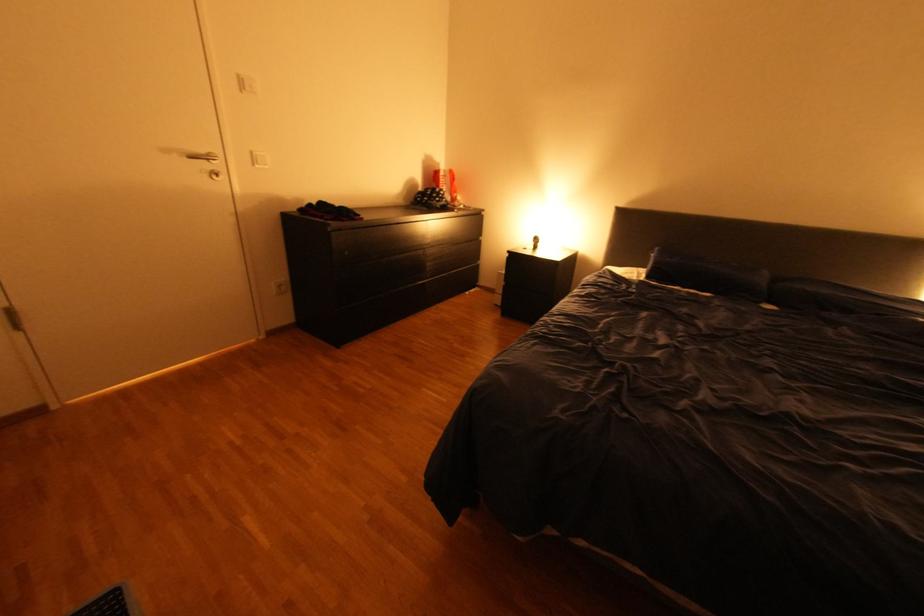
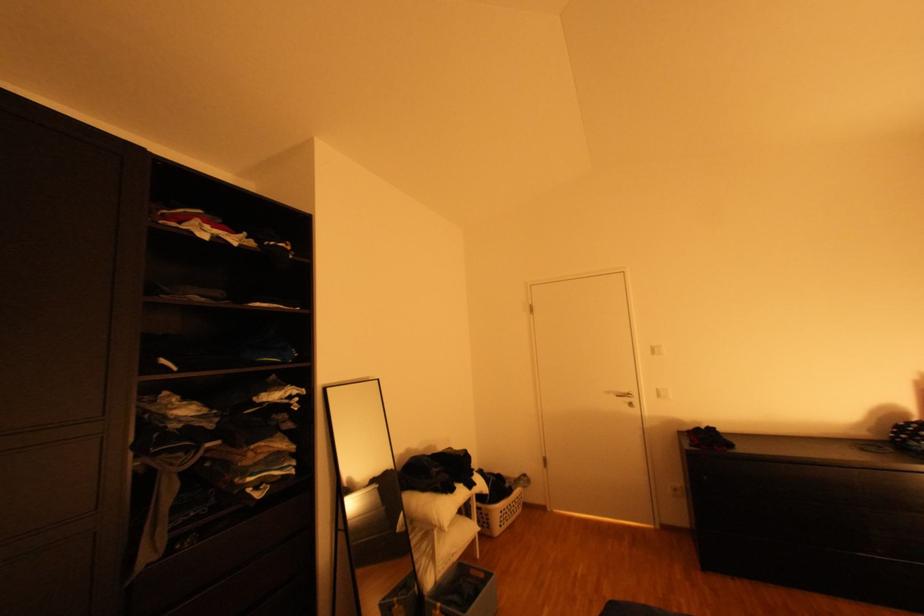
Where in the second image is the point corresponding to point (176, 150) from the first image?

(617, 392)